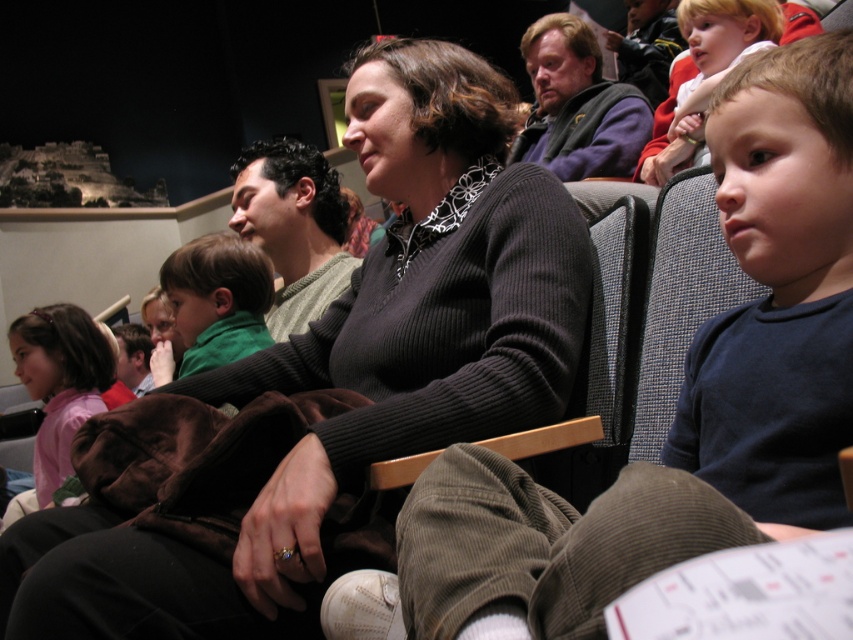
Question: Which is nearer to the vest at upper center?

Choices:
 (A) black ribbed sweater at center
 (B) green sweater at center

Answer: (B)

Question: Can you confirm if green sweater at center is positioned below pink fabric shirt at lower left?

Choices:
 (A) no
 (B) yes

Answer: (A)

Question: Is black ribbed sweater at center wider than blonde hair child at center?

Choices:
 (A) yes
 (B) no

Answer: (A)

Question: Which object is the closest to the dark blue cotton shirt at center-right?

Choices:
 (A) black ribbed sweater at center
 (B) vest at upper center

Answer: (A)

Question: Which of the following is the farthest from the observer?

Choices:
 (A) (26, 358)
 (B) (683, 36)
 (C) (469, 218)
 (D) (314, 228)

Answer: (B)

Question: Does green sweater at center appear under blonde hair child at center?

Choices:
 (A) no
 (B) yes

Answer: (B)